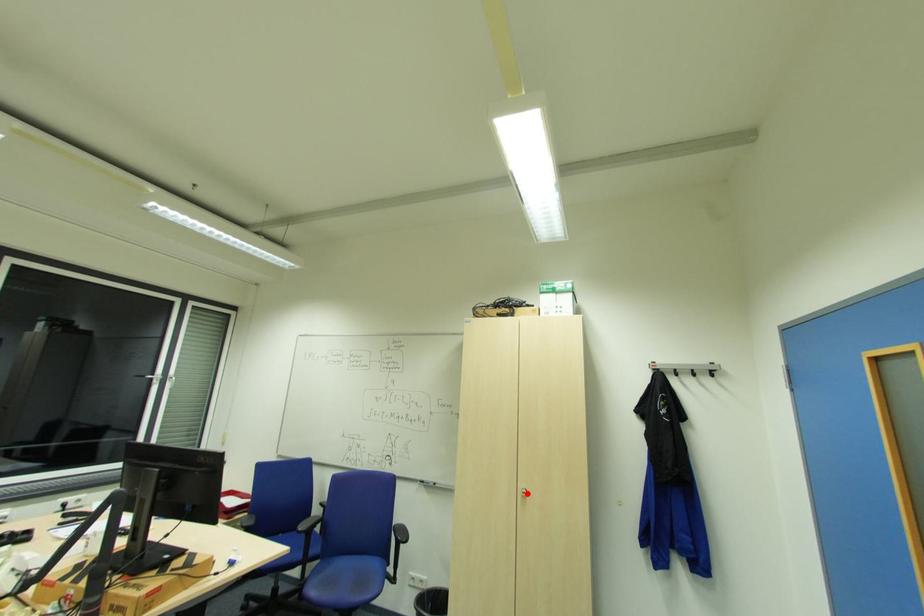
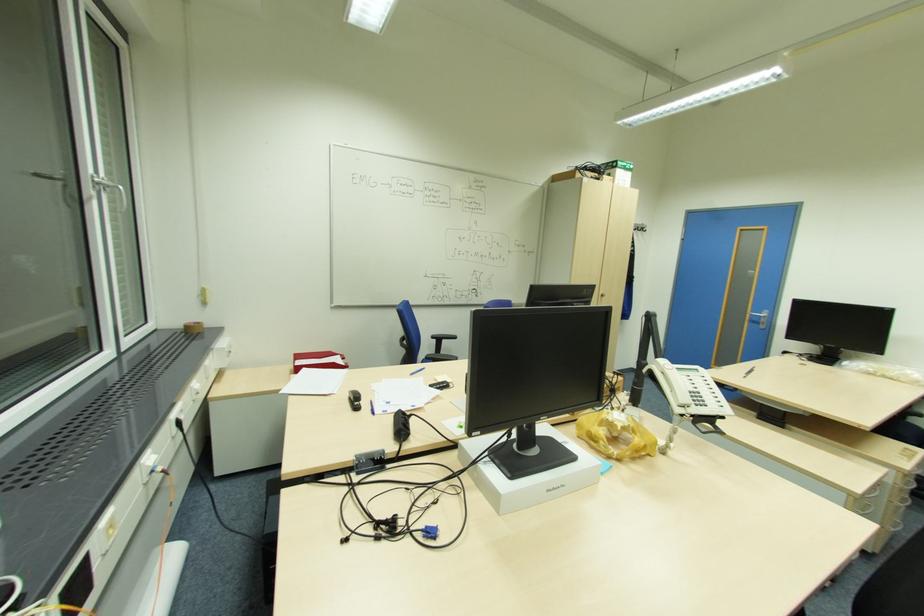
Question: I am providing you with two images of the same scene from different viewpoints. A red point is shown in image1. For the corresponding object point in image2, is it positioned nearer or farther from the camera?

Choices:
 (A) Nearer
 (B) Farther

Answer: (B)